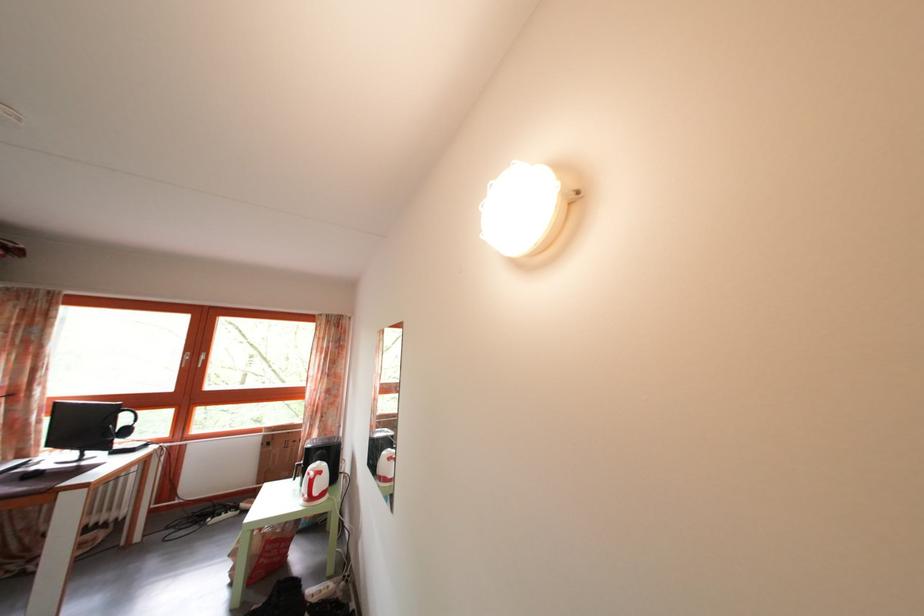
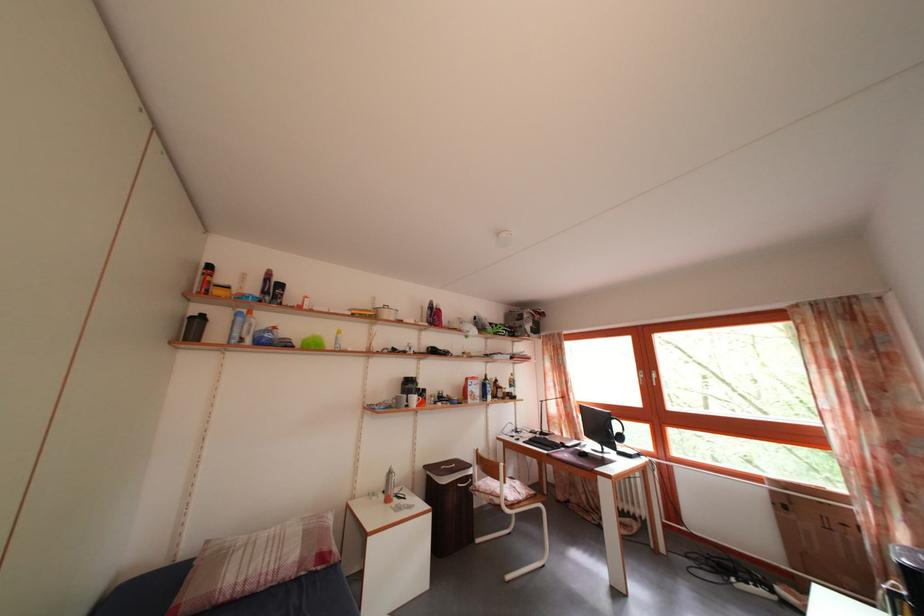
Find the pixel in the second image that matches pixel 199 363 in the first image.

(652, 382)